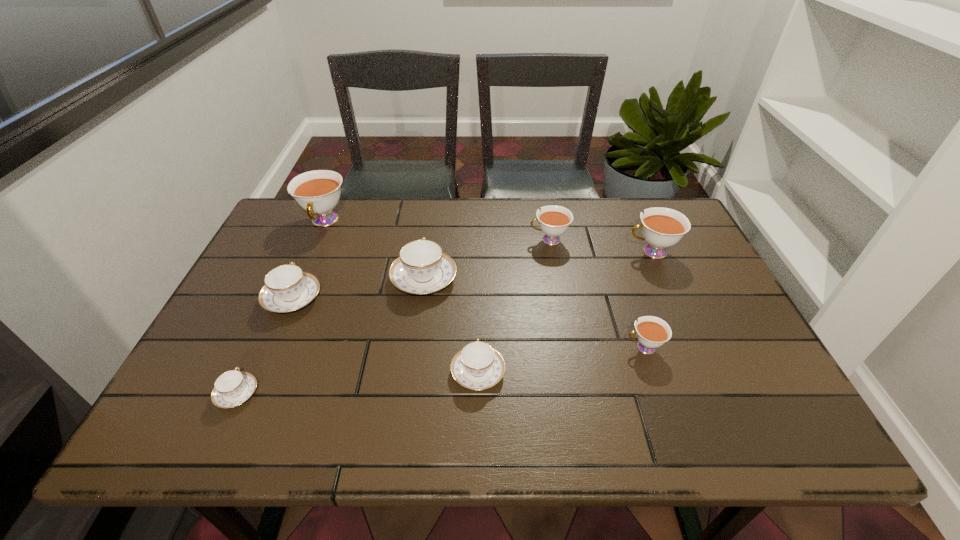
You are a GUI agent. You are given a task and a screenshot of the screen. Output one action in this format:
    pyautogui.click(x=<x>, y=<y>)
    Task: Click on the vacant space at the near edge
    
    Given the screenshot: What is the action you would take?
    pyautogui.click(x=331, y=432)

The height and width of the screenshot is (540, 960). I want to click on vacant space at the left edge of the desktop, so click(217, 375).

The image size is (960, 540). I want to click on blank area at the right edge, so click(x=726, y=378).

Locate an element on the screen. vacant region at the far left corner of the desktop is located at coordinates (293, 200).

In the image, there is a desktop. Identify the location of free region at the near right corner. (749, 414).

What are the coordinates of `free space between the biggest blue teacup and the smallest white teacup` in the screenshot? It's located at (534, 313).

Locate an element on the screen. Image resolution: width=960 pixels, height=540 pixels. vacant space that's between the shortest object and the second smallest white teacup is located at coordinates pos(393,317).

Where is `unoccupied position between the biggest blue teacup and the smallest blue teacup`? The height and width of the screenshot is (540, 960). unoccupied position between the biggest blue teacup and the smallest blue teacup is located at coordinates (330, 336).

Image resolution: width=960 pixels, height=540 pixels. What are the coordinates of `vacant region between the biggest blue teacup and the second biggest blue teacup` in the screenshot? It's located at (358, 289).

Locate an element on the screen. The width and height of the screenshot is (960, 540). vacant space in between the second smallest blue teacup and the biggest blue teacup is located at coordinates (451, 326).